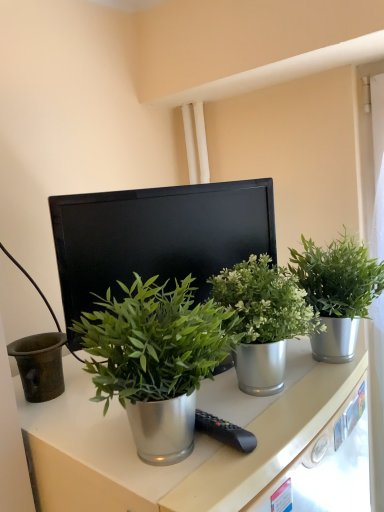
Question: Is green metallic plant at center, which ranks as the third houseplant in left-to-right order, beside black matte computer monitor at center?

Choices:
 (A) no
 (B) yes

Answer: (A)

Question: Does green metallic plant at center, which ranks as the third houseplant in left-to-right order, appear on the left side of black matte computer monitor at center?

Choices:
 (A) no
 (B) yes

Answer: (A)

Question: Can you confirm if green metallic plant at center, which is the first houseplant from right to left, is taller than black matte computer monitor at center?

Choices:
 (A) yes
 (B) no

Answer: (B)

Question: Is green metallic plant at center, which ranks as the third houseplant in left-to-right order, facing away from black matte computer monitor at center?

Choices:
 (A) no
 (B) yes

Answer: (B)

Question: Can you confirm if green metallic plant at center, which is the first houseplant from right to left, is smaller than black matte computer monitor at center?

Choices:
 (A) yes
 (B) no

Answer: (A)

Question: Does green metallic plant at center, which is the first houseplant from right to left, have a lesser height compared to black matte computer monitor at center?

Choices:
 (A) no
 (B) yes

Answer: (B)

Question: Is metallic drawer at lower right outside of green metallic plant at center, which is the first houseplant from right to left?

Choices:
 (A) yes
 (B) no

Answer: (A)

Question: Is metallic drawer at lower right taller than green metallic plant at center, which ranks as the third houseplant in left-to-right order?

Choices:
 (A) no
 (B) yes

Answer: (A)

Question: Is metallic drawer at lower right oriented towards green metallic plant at center, which ranks as the third houseplant in left-to-right order?

Choices:
 (A) yes
 (B) no

Answer: (B)

Question: Considering the relative sizes of metallic drawer at lower right and green metallic plant at center, which is the first houseplant from right to left, in the image provided, is metallic drawer at lower right bigger than green metallic plant at center, which is the first houseplant from right to left,?

Choices:
 (A) yes
 (B) no

Answer: (B)

Question: Does metallic drawer at lower right have a lesser height compared to green metallic plant at center, which is the first houseplant from right to left?

Choices:
 (A) no
 (B) yes

Answer: (B)

Question: Is metallic drawer at lower right to the right of green metallic plant at center, which is the first houseplant from right to left, from the viewer's perspective?

Choices:
 (A) no
 (B) yes

Answer: (A)

Question: From the image's perspective, does green metallic plant at center, which ranks as the first houseplant in left-to-right order, appear lower than green metallic plant at center, which ranks as the third houseplant in left-to-right order?

Choices:
 (A) yes
 (B) no

Answer: (A)